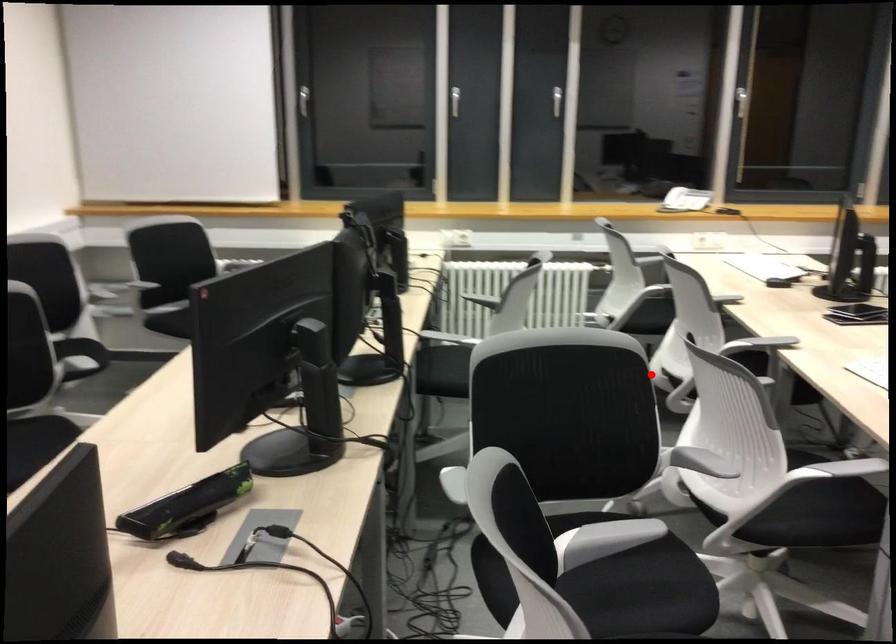
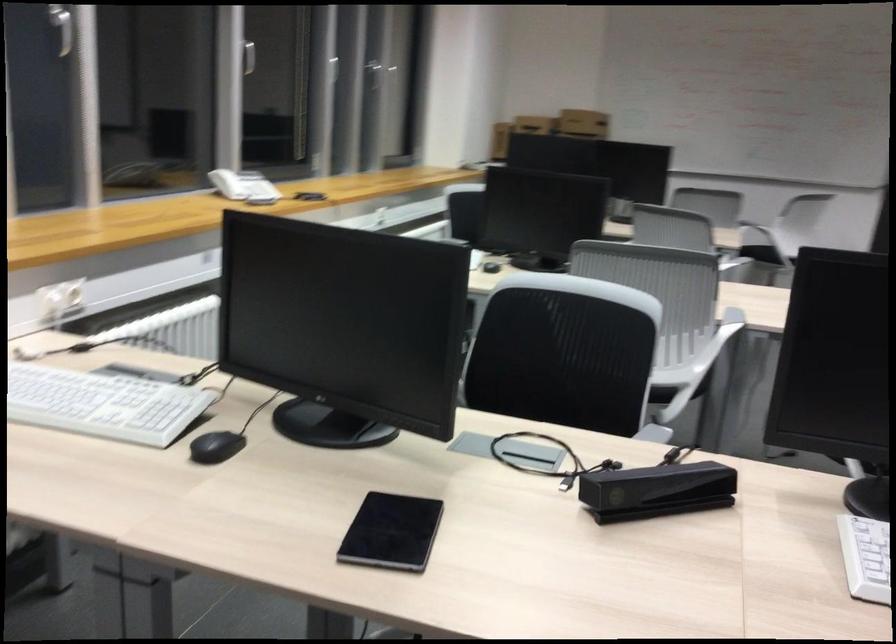
In the second image, find the point that corresponds to the highlighted location in the first image.

(661, 395)